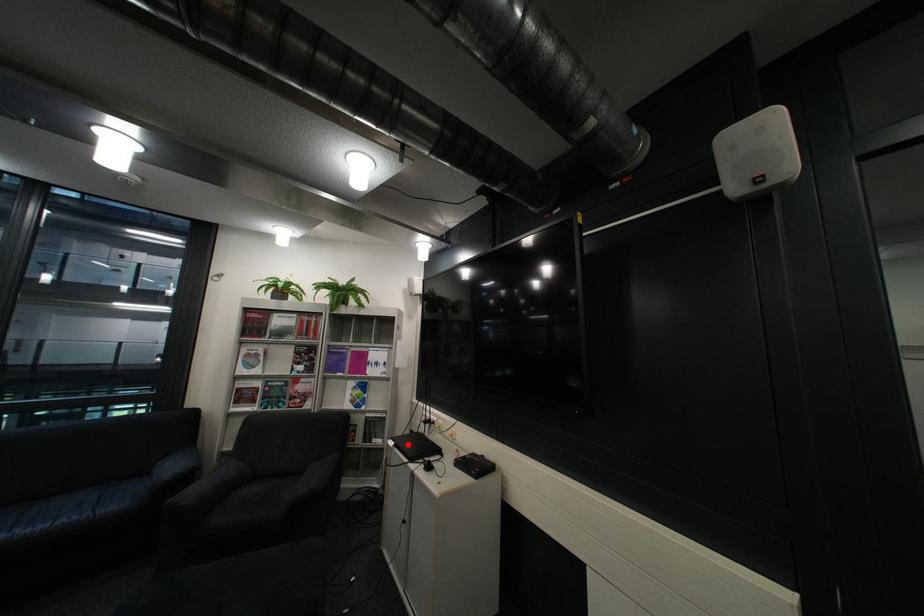
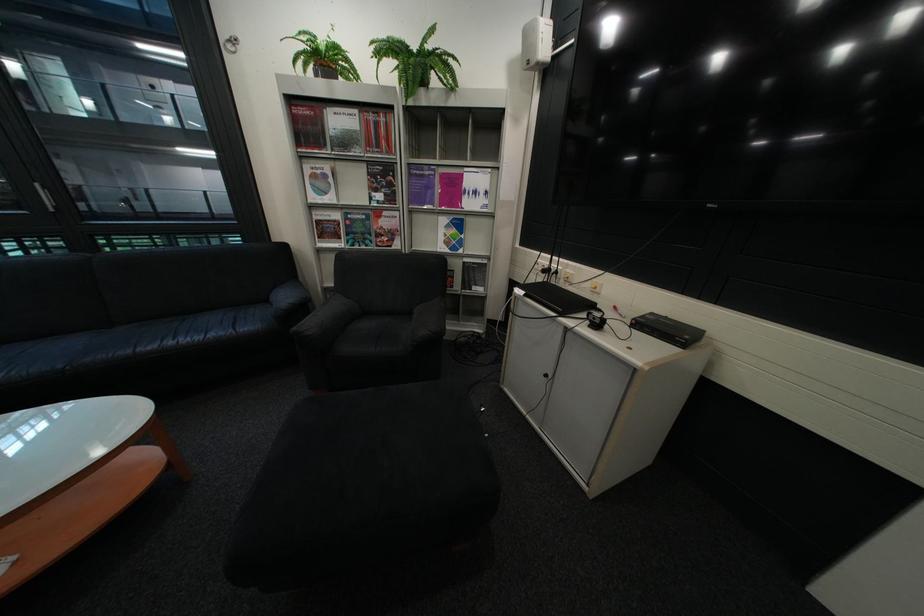
Question: I am providing you with two images of the same scene from different viewpoints. Given a red point in image1, look at the same physical point in image2. Is it:

Choices:
 (A) Closer to the viewpoint
 (B) Farther from the viewpoint

Answer: (A)